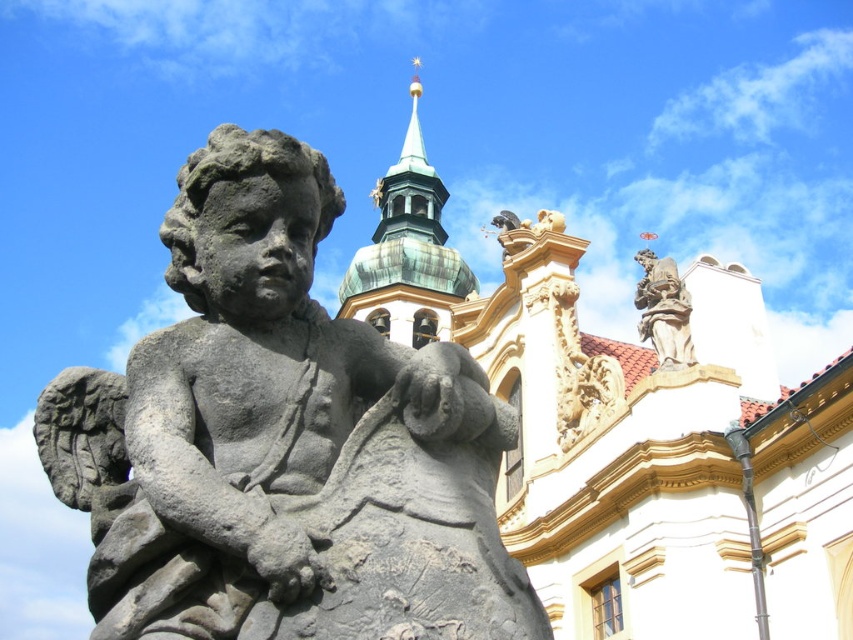
You are an art student analyzing the composition of this image. You notice the gray stone statue at center and the green copper tower at upper center. Which object is located to the left of the other?

The gray stone statue at center is positioned on the left side of green copper tower at upper center.

You are a tourist standing in front of the gray stone statue at center and the stone statue at upper right. Which statue is positioned higher in the image?

The stone statue at upper right is positioned higher than the gray stone statue at center.

You are an architect analyzing the layout of this historical site. You notice the green copper tower at upper center and the stone statue at upper right. Based on their positions, which object is located to the east of the other?

The green copper tower at upper center is located to the left of the stone statue at upper right, so the green copper tower at upper center is east of the stone statue at upper right.